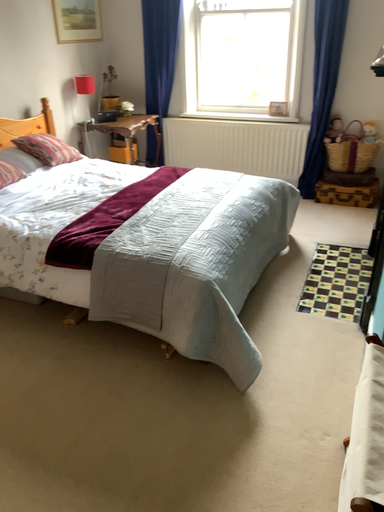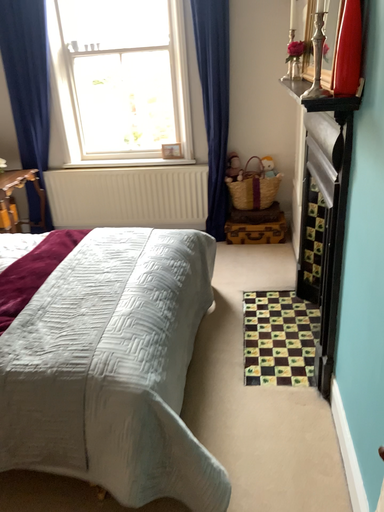
Question: How did the camera likely rotate when shooting the video?

Choices:
 (A) rotated left
 (B) rotated right

Answer: (B)